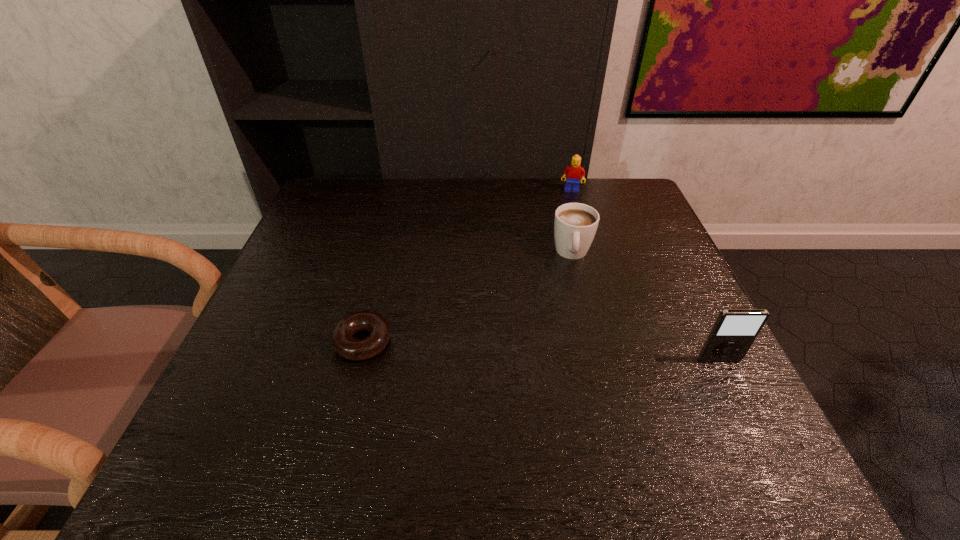
The image size is (960, 540). I want to click on free space on the desktop that is between the shortest object and the tallest object and is positioned with the handle on the side of the second farthest object, so click(x=571, y=353).

I want to click on free spot on the desktop that is between the doughnut and the tallest object and is positioned on the face of the Lego, so click(x=551, y=352).